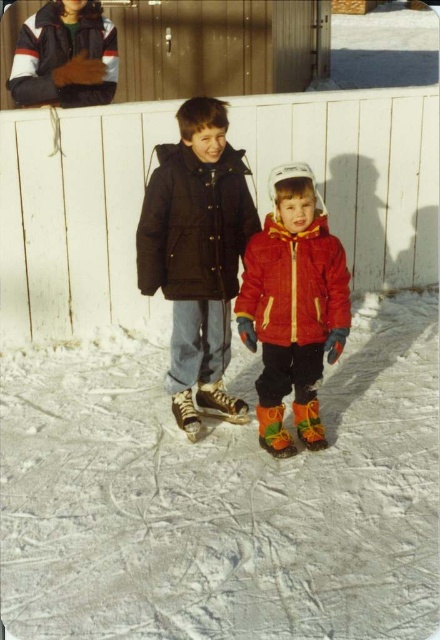
You are a photographer standing at the edge of the ice rink. You want to take a photo that includes both the matte red jacket at center and the brushed metal jacket at upper left. Based on their positions, which jacket will appear closer to the camera in the photo?

The matte red jacket at center will appear closer to the camera in the photo because it is positioned in front of the brushed metal jacket at upper left.